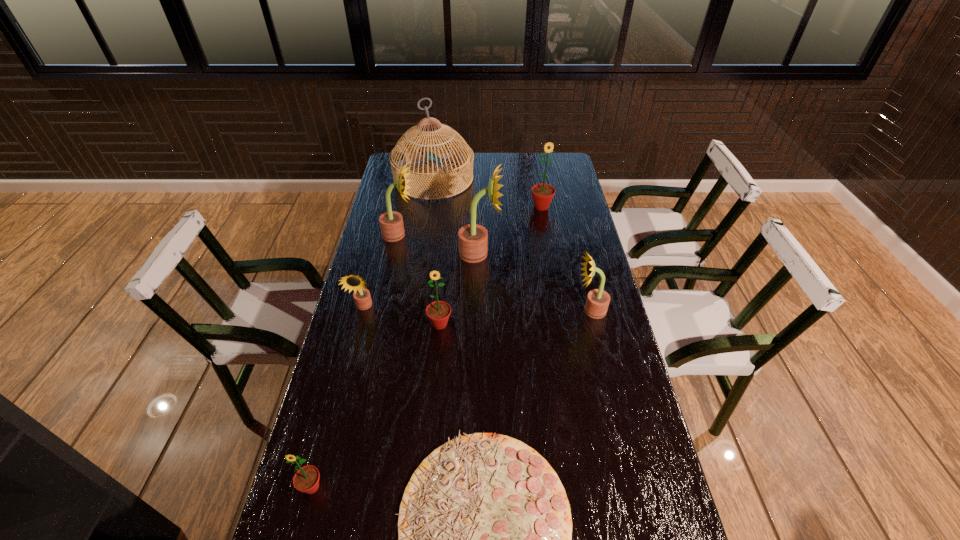
Find the location of a particular element. vacant area situated on the face of the second nearest green sunflower is located at coordinates (435, 379).

The image size is (960, 540). Find the location of `vacant region located on the face of the smallest yellow sunflower`. vacant region located on the face of the smallest yellow sunflower is located at coordinates (333, 427).

Locate an element on the screen. vacant area situated on the face of the smallest green sunflower is located at coordinates (298, 539).

In order to click on object that is at the far edge in this screenshot , I will do coord(397,158).

Where is `birdcage that is at the left edge`? The image size is (960, 540). birdcage that is at the left edge is located at coordinates (397, 158).

Locate an element on the screen. Image resolution: width=960 pixels, height=540 pixels. object that is positioned at the far left corner is located at coordinates (397, 158).

Where is `vacant area at the far edge of the desktop`? This screenshot has height=540, width=960. vacant area at the far edge of the desktop is located at coordinates (513, 173).

In the image, there is a desktop. Where is `vacant space at the left edge`? This screenshot has height=540, width=960. vacant space at the left edge is located at coordinates (348, 354).

Where is `vacant space at the right edge of the desktop`? The image size is (960, 540). vacant space at the right edge of the desktop is located at coordinates (583, 369).

Locate an element on the screen. This screenshot has height=540, width=960. vacant space at the far left corner is located at coordinates (415, 167).